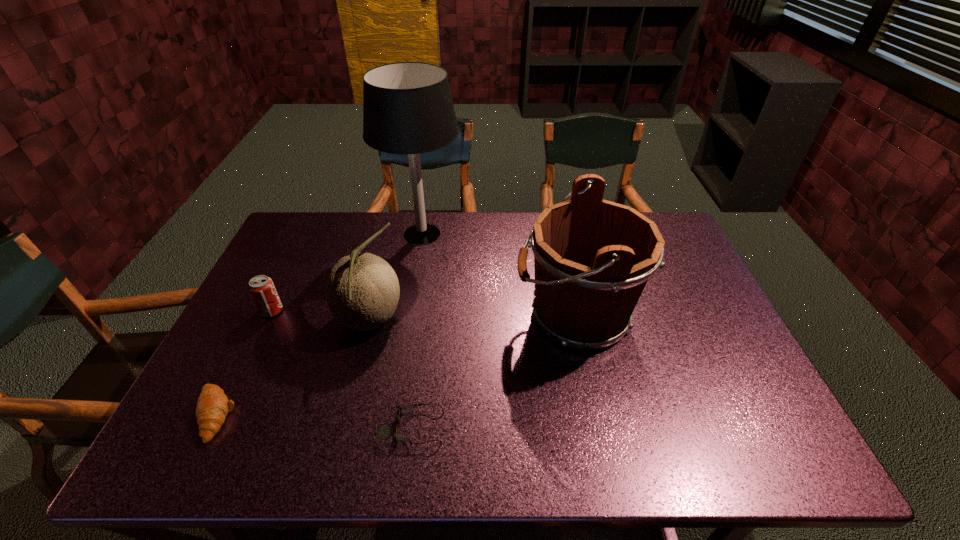
Find the location of a particular element. The width and height of the screenshot is (960, 540). free space located 0.280m with the handle on the side of the bucket is located at coordinates (413, 315).

Locate an element on the screen. The image size is (960, 540). vacant space situated with the handle on the side of the bucket is located at coordinates (453, 315).

I want to click on vacant space located 0.210m on the front of the cantaloup, so pos(343,424).

Where is `vacant space located on the right of the soda can`? This screenshot has height=540, width=960. vacant space located on the right of the soda can is located at coordinates (322, 311).

Locate an element on the screen. The width and height of the screenshot is (960, 540). vacant space located on the back of the fifth tallest object is located at coordinates (274, 294).

In order to click on vacant space situated on the front-facing side of the shortest object in this screenshot , I will do `click(588, 427)`.

Locate an element on the screen. The height and width of the screenshot is (540, 960). object that is at the far edge is located at coordinates (408, 109).

Locate an element on the screen. The image size is (960, 540). crescent roll present at the near edge is located at coordinates (213, 405).

Where is `spectacles that is at the near edge`? spectacles that is at the near edge is located at coordinates (384, 431).

At what (x,y) coordinates should I click in order to perform the action: click on soda can at the left edge. Please return your answer as a coordinate pair (x, y). Looking at the image, I should click on pyautogui.click(x=262, y=289).